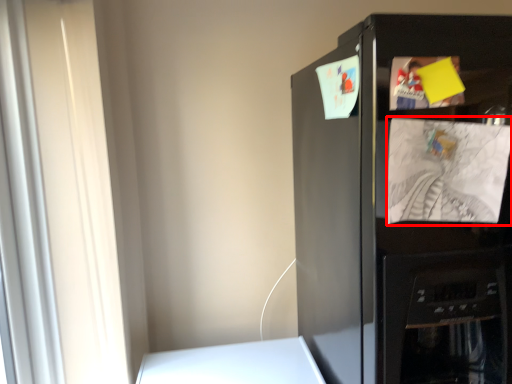
Question: Where is paper (annotated by the red box) located in relation to refrigerator in the image?

Choices:
 (A) left
 (B) right

Answer: (A)